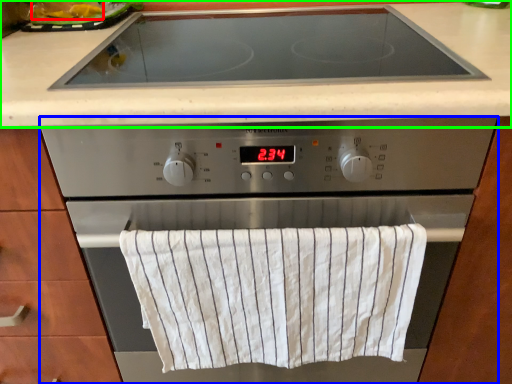
Question: Considering the real-world distances, which object is closest to food (highlighted by a red box)? home appliance (highlighted by a blue box) or countertop (highlighted by a green box).

Choices:
 (A) home appliance
 (B) countertop

Answer: (B)